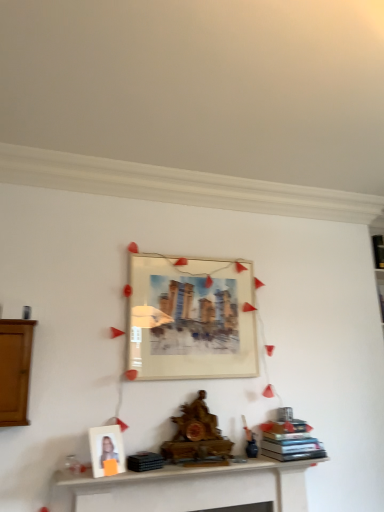
Question: Is black matte book at upper right, marked as the 2th book in a left-to-right arrangement, closer to the viewer compared to brown wooden cabinet at left?

Choices:
 (A) no
 (B) yes

Answer: (A)

Question: From the image's perspective, is black matte book at upper right, the second book when ordered from front to back, above brown wooden cabinet at left?

Choices:
 (A) yes
 (B) no

Answer: (A)

Question: Considering the relative sizes of black matte book at upper right, the 2th book from the bottom, and brown wooden cabinet at left in the image provided, is black matte book at upper right, the 2th book from the bottom, wider than brown wooden cabinet at left?

Choices:
 (A) no
 (B) yes

Answer: (A)

Question: Is black matte book at upper right, the second book when ordered from front to back, far from brown wooden cabinet at left?

Choices:
 (A) no
 (B) yes

Answer: (B)

Question: Considering the relative sizes of black matte book at upper right, which appears as the first book when viewed from the top, and brown wooden cabinet at left in the image provided, is black matte book at upper right, which appears as the first book when viewed from the top, thinner than brown wooden cabinet at left?

Choices:
 (A) yes
 (B) no

Answer: (A)

Question: Is white matte picture frame at lower left, arranged as the first picture frame when ordered from the bottom, inside the boundaries of hardcover books at center, which is the second book in right-to-left order, or outside?

Choices:
 (A) outside
 (B) inside

Answer: (A)

Question: Is point (117, 433) closer or farther from the camera than point (304, 431)?

Choices:
 (A) closer
 (B) farther

Answer: (A)

Question: Based on their sizes in the image, would you say white matte picture frame at lower left, the second picture frame viewed from the right, is bigger or smaller than hardcover books at center, marked as the first book in a bottom-to-top arrangement?

Choices:
 (A) big
 (B) small

Answer: (B)

Question: From a real-world perspective, is white matte picture frame at lower left, which appears as the 2th picture frame when viewed from the top, positioned above or below hardcover books at center, marked as the first book in a bottom-to-top arrangement?

Choices:
 (A) below
 (B) above

Answer: (B)

Question: Considering the positions of point (3, 364) and point (278, 442), is point (3, 364) closer or farther from the camera than point (278, 442)?

Choices:
 (A) closer
 (B) farther

Answer: (A)

Question: Is brown wooden cabinet at left in front of or behind hardcover books at center, marked as the first book in a bottom-to-top arrangement, in the image?

Choices:
 (A) behind
 (B) front

Answer: (B)

Question: From the image's perspective, is brown wooden cabinet at left located above or below hardcover books at center, which is the second book in right-to-left order?

Choices:
 (A) above
 (B) below

Answer: (A)

Question: Is brown wooden cabinet at left situated inside hardcover books at center, which is the second book in right-to-left order, or outside?

Choices:
 (A) inside
 (B) outside

Answer: (B)

Question: In terms of width, does matte paper picture frame at center look wider or thinner when compared to matte white picture frame at center, arranged as the first picture frame when viewed from the back?

Choices:
 (A) thin
 (B) wide

Answer: (B)

Question: Is matte paper picture frame at center taller or shorter than matte white picture frame at center, which ranks as the 1th picture frame in top-to-bottom order?

Choices:
 (A) short
 (B) tall

Answer: (B)